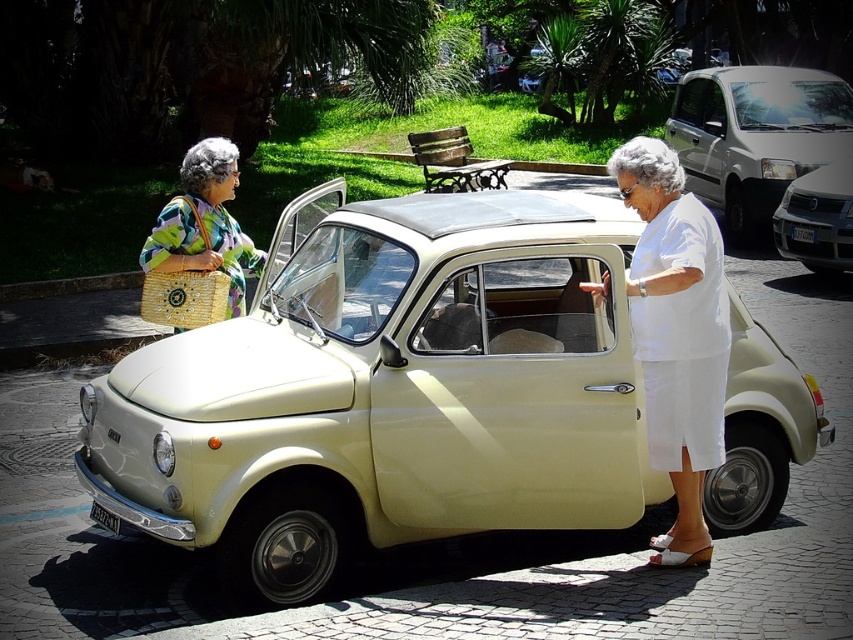
You are a photographer trying to capture the white cotton dress at center in your shot. The camera is positioned at the point with coordinates (676, 333). Can you confirm if the camera is already focused on the white cotton dress at center?

The point with coordinates (676, 333) corresponds to the white cotton dress at center, so yes, the camera is focused on the white cotton dress at center.

You are a delivery person who needs to place a package on top of the metallic silver car at center without disturbing the multicolored woven bag at upper left. Is the bag currently in the way of the car roof?

The multicolored woven bag at upper left is positioned under the metallic silver car at center, so it is not on the roof. Therefore, the bag is not in the way of the car roof, and you can safely place the package there.

You are a photographer positioned at the origin point of the image coordinate system. You want to capture a closeup shot of the white cotton dress at center. What are the coordinates you should aim your camera at?

The coordinates to aim the camera at are point (676, 333), as that is where the white cotton dress at center is located.